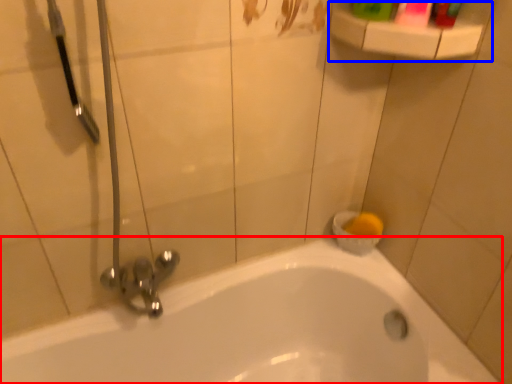
Question: Which of the following is the closest to the observer, bathtub (highlighted by a red box) or balustrade (highlighted by a blue box)?

Choices:
 (A) bathtub
 (B) balustrade

Answer: (A)